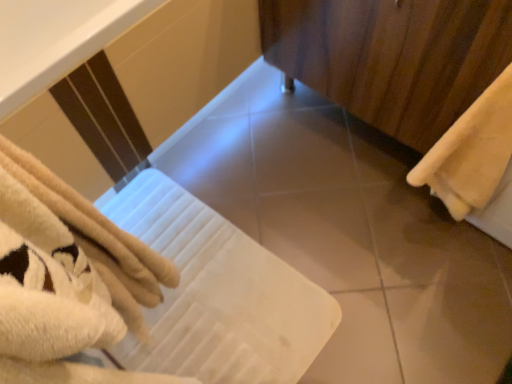
Question: Is smooth beige tile at center positioned beyond the bounds of wooden curtain at right?

Choices:
 (A) yes
 (B) no

Answer: (A)

Question: Is smooth beige tile at center taller than wooden curtain at right?

Choices:
 (A) no
 (B) yes

Answer: (A)

Question: Could wooden curtain at right be considered to be inside smooth beige tile at center?

Choices:
 (A) yes
 (B) no

Answer: (B)

Question: From the image's perspective, does smooth beige tile at center appear higher than wooden curtain at right?

Choices:
 (A) no
 (B) yes

Answer: (A)

Question: From the image's perspective, is smooth beige tile at center beneath wooden curtain at right?

Choices:
 (A) no
 (B) yes

Answer: (B)

Question: From a real-world perspective, is smooth beige tile at center below wooden curtain at right?

Choices:
 (A) no
 (B) yes

Answer: (B)

Question: Considering the relative sizes of beige soft towel at right and wooden curtain at right in the image provided, is beige soft towel at right taller than wooden curtain at right?

Choices:
 (A) no
 (B) yes

Answer: (A)

Question: Is beige soft towel at right to the right of wooden curtain at right from the viewer's perspective?

Choices:
 (A) no
 (B) yes

Answer: (B)

Question: Does beige soft towel at right lie in front of wooden curtain at right?

Choices:
 (A) yes
 (B) no

Answer: (A)

Question: Is wooden curtain at right located within beige soft towel at right?

Choices:
 (A) yes
 (B) no

Answer: (B)

Question: Is beige soft towel at right shorter than wooden curtain at right?

Choices:
 (A) yes
 (B) no

Answer: (A)

Question: Can you confirm if beige soft towel at right is bigger than wooden curtain at right?

Choices:
 (A) no
 (B) yes

Answer: (A)

Question: Is wooden curtain at right positioned far away from smooth beige tile at center?

Choices:
 (A) no
 (B) yes

Answer: (A)